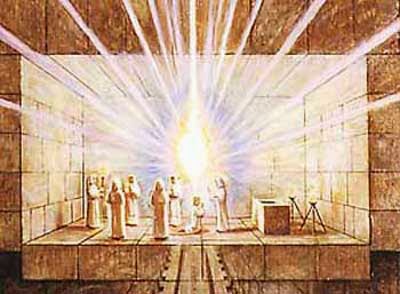
Where is `painting`? The image size is (400, 294). painting is located at coordinates (302, 189).